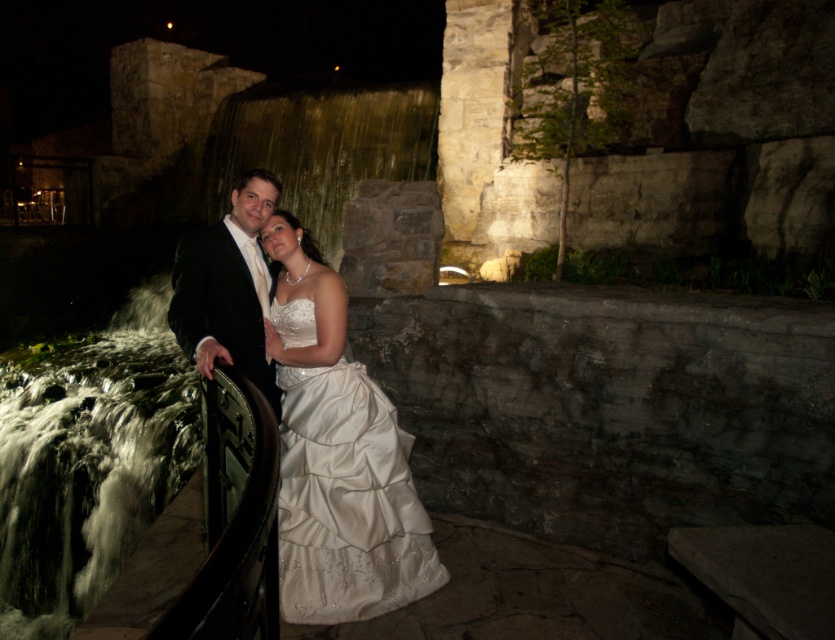
Can you confirm if satin white dress at center is positioned to the left of shiny black suit at center?

No, satin white dress at center is not to the left of shiny black suit at center.

Which is more to the right, satin white dress at center or shiny black suit at center?

satin white dress at center

Between point (360, 435) and point (188, 272), which one is positioned in front?

Positioned in front is point (360, 435).

The width and height of the screenshot is (835, 640). What are the coordinates of `satin white dress at center` in the screenshot? It's located at (311, 419).

Is satin/sheen wedding dress at center taller than shiny black suit at center?

Yes.

Who is higher up, satin/sheen wedding dress at center or shiny black suit at center?

Positioned higher is shiny black suit at center.

Between point (388, 481) and point (262, 380), which one is positioned behind?

The point (262, 380) is more distant.

This screenshot has height=640, width=835. Identify the location of satin/sheen wedding dress at center. (347, 500).

Which is below, satin white dress at center or satin/sheen wedding dress at center?

Positioned lower is satin/sheen wedding dress at center.

Locate an element on the screen. This screenshot has width=835, height=640. satin white dress at center is located at coordinates click(311, 419).